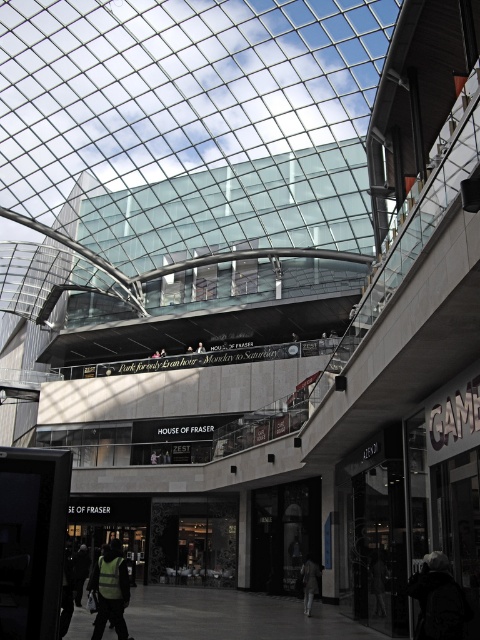
Is dark gray jacket at lower right shorter than dark gray jacket at lower center?

Indeed, dark gray jacket at lower right has a lesser height compared to dark gray jacket at lower center.

Can you confirm if dark gray jacket at lower right is taller than dark gray jacket at lower center?

In fact, dark gray jacket at lower right may be shorter than dark gray jacket at lower center.

Where is `dark gray jacket at lower right`? This screenshot has width=480, height=640. dark gray jacket at lower right is located at coordinates click(437, 600).

From the picture: Is dark gray jacket at lower center shorter than green fabric jacket at center?

No, dark gray jacket at lower center is not shorter than green fabric jacket at center.

Is point (313, 564) less distant than point (204, 349)?

That is True.

Who is more forward, (317, 564) or (201, 349)?

Point (317, 564) is in front.

Identify the location of dark gray jacket at lower center. Image resolution: width=480 pixels, height=640 pixels. (309, 582).

Which is below, dark gray jacket at lower right or reflective yellow vest at lower left?

Positioned lower is reflective yellow vest at lower left.

Between point (455, 593) and point (100, 628), which one is positioned behind?

Point (100, 628)

Between point (446, 611) and point (95, 620), which one is positioned behind?

Positioned behind is point (95, 620).

I want to click on dark gray jacket at lower right, so click(437, 600).